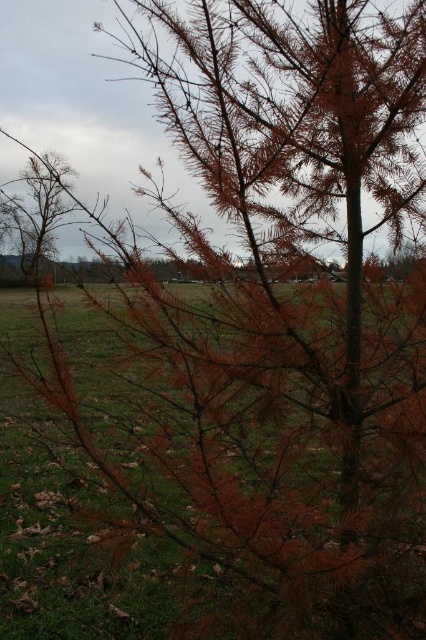
Question: Which object appears farthest from the camera in this image?

Choices:
 (A) brown matte tree at center
 (B) brown bark tree at left

Answer: (B)

Question: Can you confirm if brown matte tree at center is positioned above brown bark tree at left?

Choices:
 (A) yes
 (B) no

Answer: (B)

Question: Is brown matte tree at center positioned at the back of brown bark tree at left?

Choices:
 (A) no
 (B) yes

Answer: (A)

Question: Is brown matte tree at center closer to camera compared to brown bark tree at left?

Choices:
 (A) yes
 (B) no

Answer: (A)